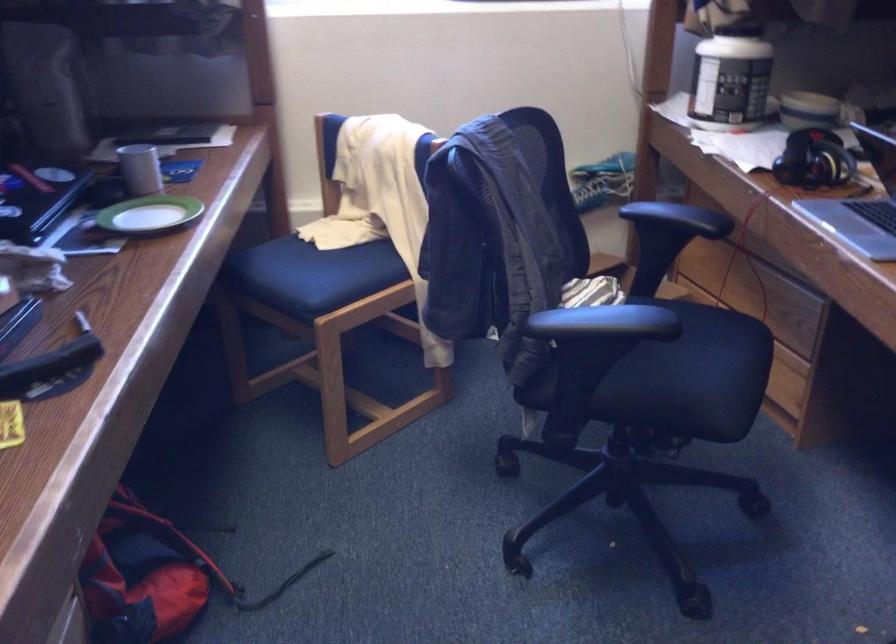
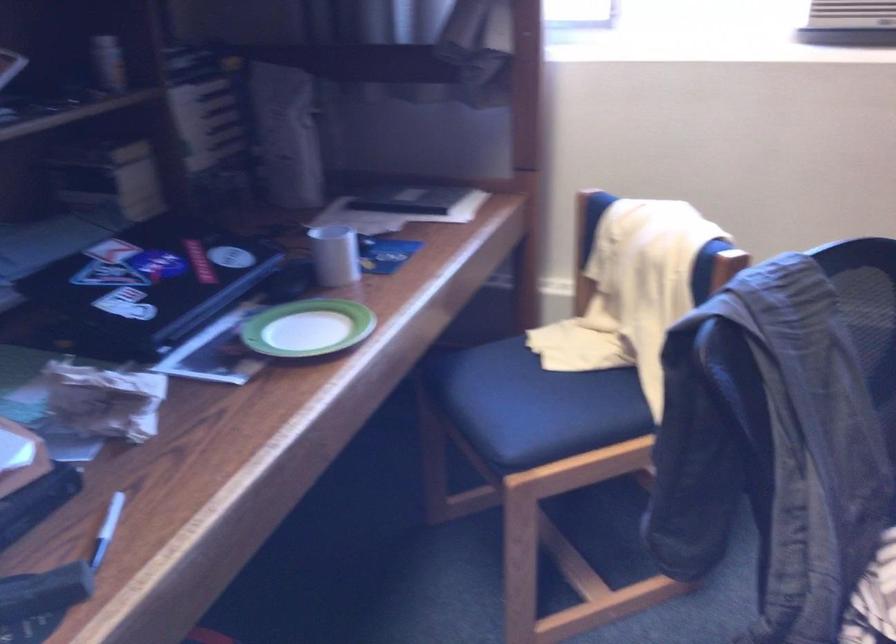
The point at (147, 218) is marked in the first image. Where is the corresponding point in the second image?

(307, 328)